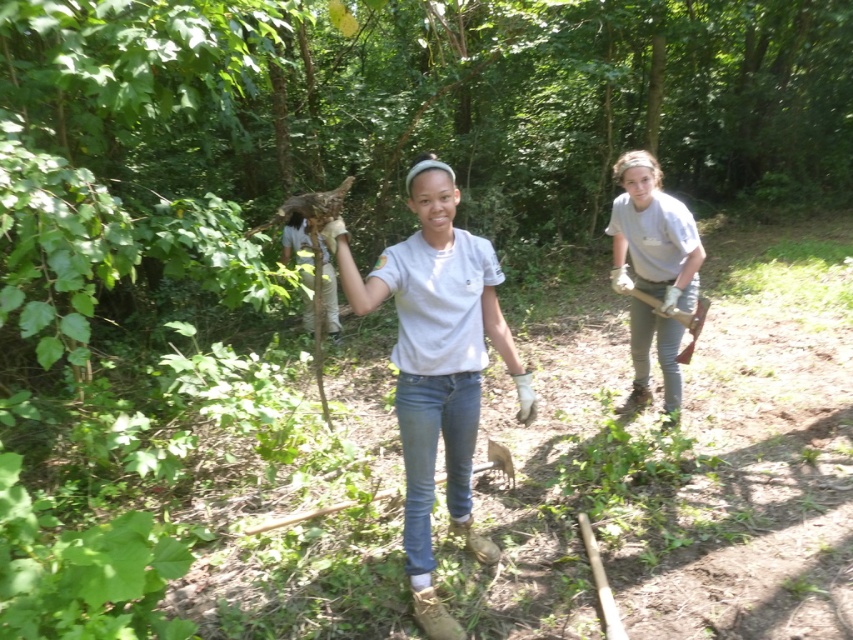
In the scene shown: You are a photographer wanting to capture a closeup of the gray matte shirt at right and the wooden shovel at right in the scene. Given their sizes, which object should you zoom in on to ensure both are in focus without moving the camera?

The gray matte shirt at right is larger than the wooden shovel at right, so you should zoom in on the gray matte shirt at right to ensure both are in focus without moving the camera.

You are a photographer standing at the center of the scene. You want to take a photo that includes both the point at coordinates point (515, 381) and point (691, 336). Which point should you focus on to ensure both are in sharp focus?

You should focus on point (515, 381) because it is closer to the camera than point (691, 336). By focusing on the closer point, the depth of field will likely cover both points, ensuring they are both in sharp focus.